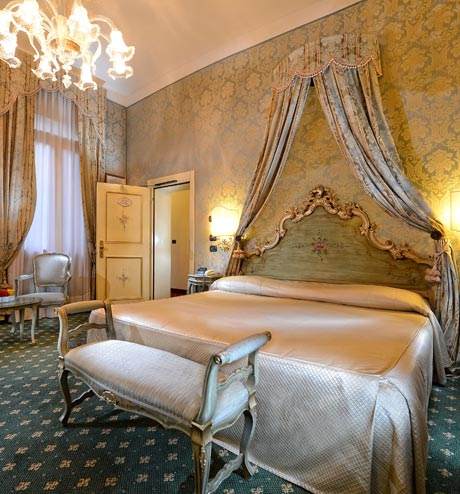
Find the location of a particular element. This screenshot has width=460, height=494. 1 doorknob is located at coordinates (100, 250).